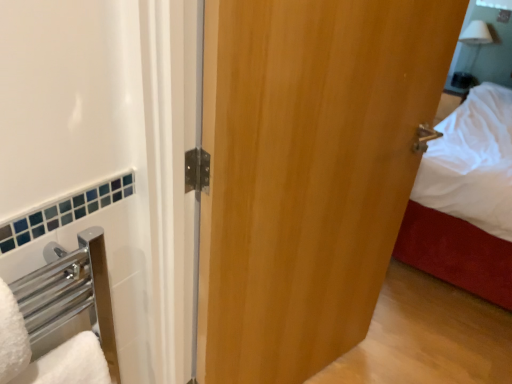
Question: Is white glossy mirror at upper right further to the viewer compared to wooden door at center?

Choices:
 (A) yes
 (B) no

Answer: (A)

Question: Does white glossy mirror at upper right lie in front of wooden door at center?

Choices:
 (A) no
 (B) yes

Answer: (A)

Question: Is there a large distance between white glossy mirror at upper right and wooden door at center?

Choices:
 (A) yes
 (B) no

Answer: (A)

Question: Is white glossy mirror at upper right aimed at wooden door at center?

Choices:
 (A) no
 (B) yes

Answer: (B)

Question: Is white glossy mirror at upper right positioned beyond the bounds of wooden door at center?

Choices:
 (A) yes
 (B) no

Answer: (A)

Question: Considering the relative positions of white glossy mirror at upper right and wooden door at center in the image provided, is white glossy mirror at upper right to the right of wooden door at center from the viewer's perspective?

Choices:
 (A) no
 (B) yes

Answer: (B)

Question: Is white fluffy bath towel at lower left bigger than white glossy mirror at upper right?

Choices:
 (A) yes
 (B) no

Answer: (B)

Question: Would you say white fluffy bath towel at lower left is a long distance from white glossy mirror at upper right?

Choices:
 (A) yes
 (B) no

Answer: (A)

Question: Is white fluffy bath towel at lower left looking in the opposite direction of white glossy mirror at upper right?

Choices:
 (A) yes
 (B) no

Answer: (B)

Question: Considering the relative sizes of white fluffy bath towel at lower left and white glossy mirror at upper right in the image provided, is white fluffy bath towel at lower left shorter than white glossy mirror at upper right?

Choices:
 (A) no
 (B) yes

Answer: (B)

Question: From the image's perspective, is white fluffy bath towel at lower left under white glossy mirror at upper right?

Choices:
 (A) yes
 (B) no

Answer: (A)

Question: Is white fluffy bath towel at lower left next to white glossy mirror at upper right and touching it?

Choices:
 (A) no
 (B) yes

Answer: (A)

Question: Is wooden door at center behind white glossy mirror at upper right?

Choices:
 (A) no
 (B) yes

Answer: (A)